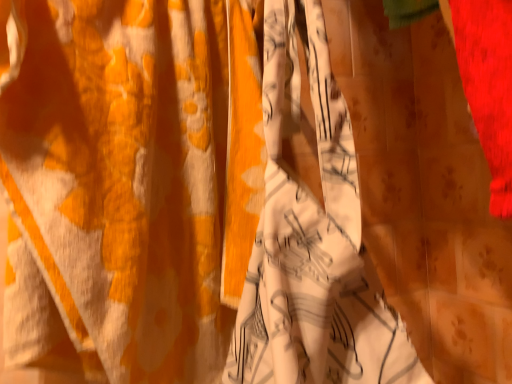
Question: In terms of width, does white printed fabric at center look wider or thinner when compared to white printed fabric at center?

Choices:
 (A) wide
 (B) thin

Answer: (B)

Question: Is point (5, 122) positioned closer to the camera than point (295, 339)?

Choices:
 (A) closer
 (B) farther

Answer: (B)

Question: In terms of size, does white printed fabric at center appear bigger or smaller than white printed fabric at center?

Choices:
 (A) big
 (B) small

Answer: (A)

Question: Is white printed fabric at center inside the boundaries of white printed fabric at center, or outside?

Choices:
 (A) inside
 (B) outside

Answer: (B)

Question: From a real-world perspective, is white printed fabric at center physically located above or below white printed fabric at center?

Choices:
 (A) above
 (B) below

Answer: (B)

Question: Looking at their shapes, would you say white printed fabric at center is wider or thinner than white printed fabric at center?

Choices:
 (A) wide
 (B) thin

Answer: (A)

Question: In the image, is white printed fabric at center positioned in front of or behind white printed fabric at center?

Choices:
 (A) behind
 (B) front

Answer: (B)